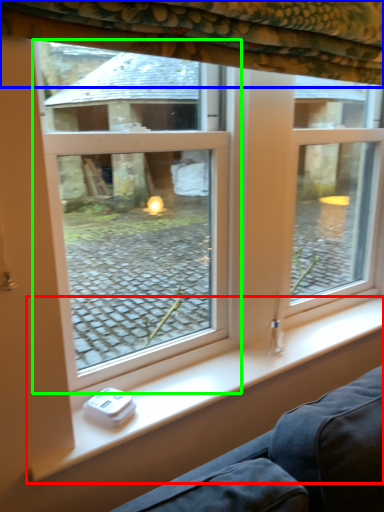
Question: Which object is positioned closest to window sill (highlighted by a red box)? Select from curtain (highlighted by a blue box) and window (highlighted by a green box).

Choices:
 (A) curtain
 (B) window

Answer: (A)